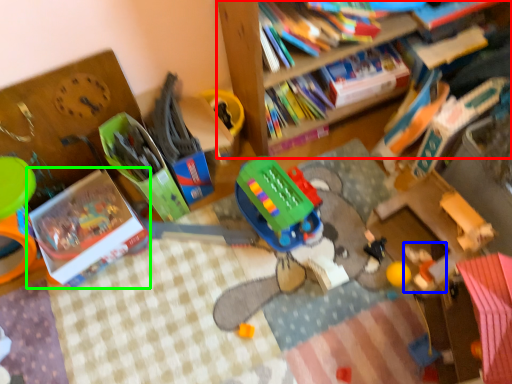
Question: Estimate the real-world distances between objects in this image. Which object is farther from bookcase (highlighted by a red box), toy (highlighted by a blue box) or book (highlighted by a green box)?

Choices:
 (A) toy
 (B) book

Answer: (B)